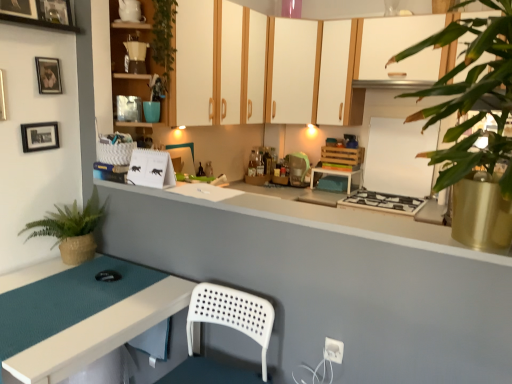
Identify the location of free space in front of braided straw pot at left, which is the 1th houseplant in back-to-front order. (62, 288).